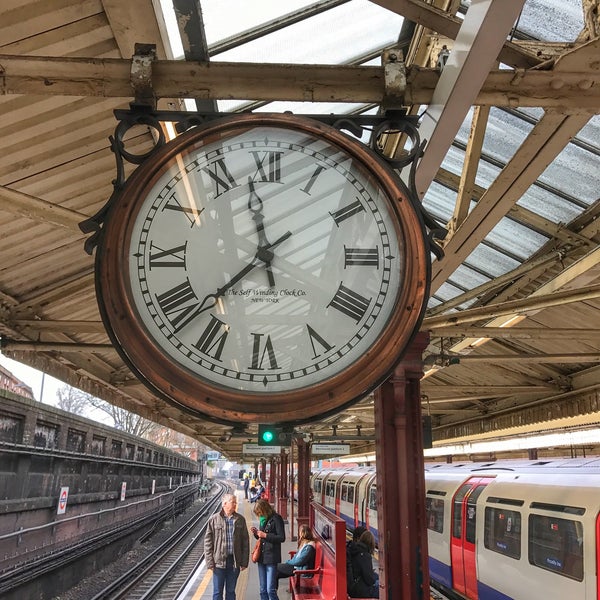
This screenshot has width=600, height=600. In order to click on bench in this screenshot , I will do `click(321, 586)`, `click(268, 495)`.